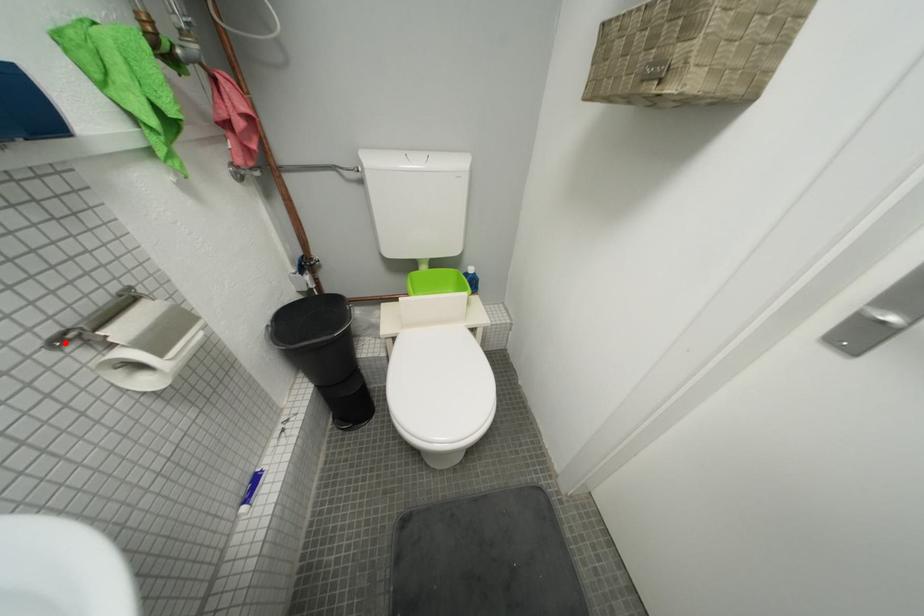
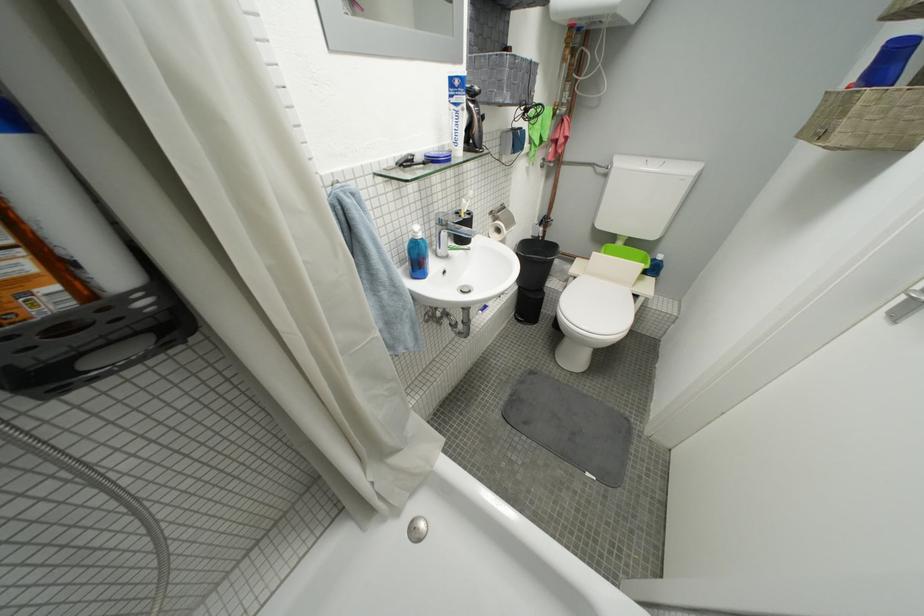
In the second image, find the point that corresponds to the highlighted location in the first image.

(500, 214)